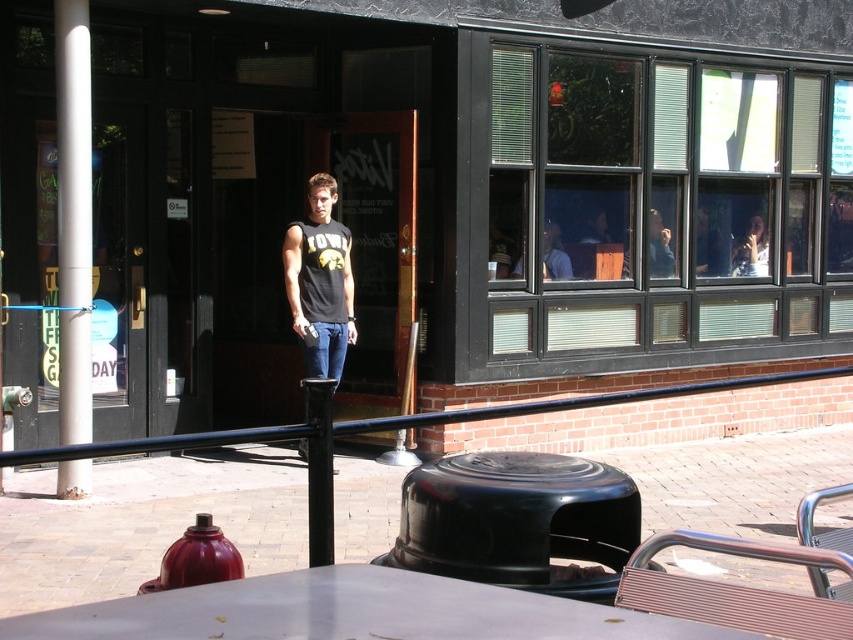
Can you confirm if clear glass window at upper center is thinner than matte black t-shirt at upper center?

No.

Is clear glass window at upper center taller than matte black t-shirt at upper center?

Indeed, clear glass window at upper center has a greater height compared to matte black t-shirt at upper center.

The height and width of the screenshot is (640, 853). In order to click on clear glass window at upper center in this screenshot , I will do `click(648, 209)`.

Can you confirm if white glossy pole at left is shorter than jeans at center?

No.

Which of these two, white glossy pole at left or jeans at center, stands taller?

white glossy pole at left is taller.

This screenshot has width=853, height=640. I want to click on white glossy pole at left, so click(73, 218).

Is point (517, 532) positioned in front of point (546, 248)?

Yes.

Which is in front, point (496, 464) or point (548, 248)?

Point (496, 464) is more forward.

Which is behind, point (509, 545) or point (560, 259)?

Point (560, 259)

You are a GUI agent. You are given a task and a screenshot of the screen. Output one action in this format:
    pyautogui.click(x=<x>, y=<y>)
    Task: Click on the black rubber stool at center
    
    Given the screenshot: What is the action you would take?
    pyautogui.click(x=518, y=522)